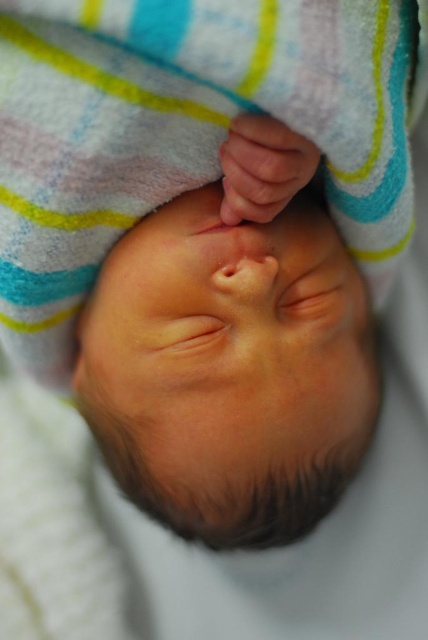
Can you confirm if smooth skin head at center is positioned to the left of smooth skin hand at upper center?

Yes, smooth skin head at center is to the left of smooth skin hand at upper center.

Based on the photo, can you confirm if smooth skin head at center is smaller than smooth skin hand at upper center?

Incorrect, smooth skin head at center is not smaller in size than smooth skin hand at upper center.

What do you see at coordinates (229, 369) in the screenshot? I see `smooth skin head at center` at bounding box center [229, 369].

Where is `smooth skin head at center`? This screenshot has height=640, width=428. smooth skin head at center is located at coordinates (229, 369).